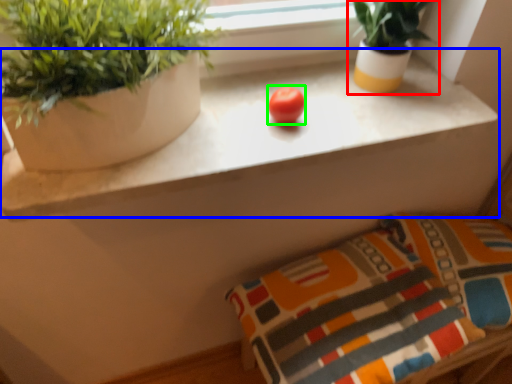
Question: Based on their relative distances, which object is farther from houseplant (highlighted by a red box)? Choose from counter (highlighted by a blue box) and fruit (highlighted by a green box).

Choices:
 (A) counter
 (B) fruit

Answer: (B)